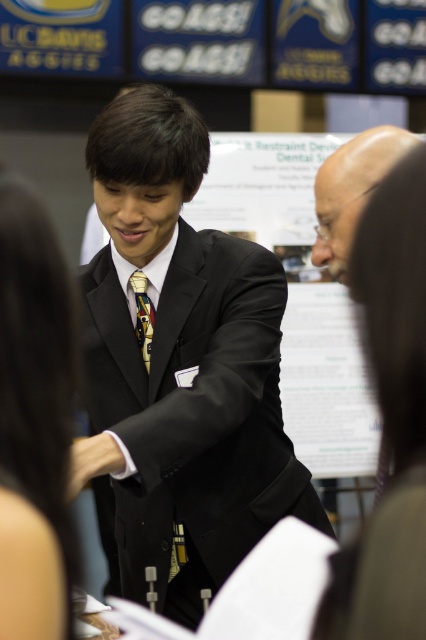
You are standing at the center of the event venue and see two points marked in the image. The first point is at coordinates point [334,609] and the second is at point [48,227]. Which point is closer to you?

Point [334,609] is in front of point [48,227], so the first point is closer to you.

You are taking a photo of the scene described. If you want to focus on an object closer to the camera, which point should you choose between point (3, 269) and point (141, 296)?

Point (3, 269) is closer to the camera than point (141, 296), so you should choose point (3, 269).

You are taking a photo of the scene described. The camera you are using has a focus point at coordinate 0.5, 0.9. Where should you adjust the focus to capture the smooth brown hair at upper right more clearly?

The smooth brown hair at upper right is located at point (396,308), so you should adjust the focus point slightly to the left and upwards from (383,320) to align with its coordinates.